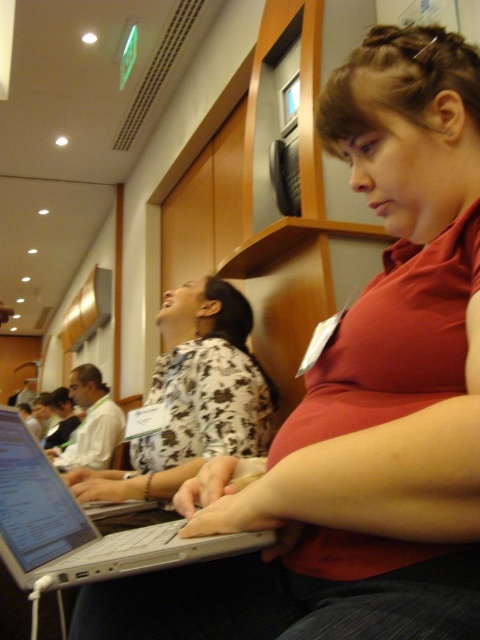
Question: Does white floral shirt at center have a smaller size compared to silver metallic laptop at center?

Choices:
 (A) yes
 (B) no

Answer: (B)

Question: Is white floral shirt at center to the left of silver metallic laptop at center from the viewer's perspective?

Choices:
 (A) yes
 (B) no

Answer: (B)

Question: Which object is farther from the camera taking this photo?

Choices:
 (A) silver metallic laptop at center
 (B) white floral shirt at center

Answer: (B)

Question: Which point is closer to the camera?

Choices:
 (A) (183, 324)
 (B) (6, 515)

Answer: (B)

Question: Which of the following is the farthest from the observer?

Choices:
 (A) silver metallic laptop at center
 (B) white floral shirt at center

Answer: (B)

Question: In this image, where is white floral shirt at center located relative to silver metallic laptop at center?

Choices:
 (A) above
 (B) below

Answer: (A)